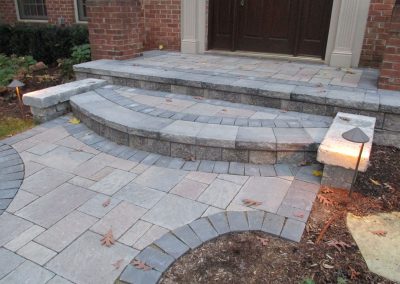
Find the location of `pillar`. pillar is located at coordinates (118, 40), (395, 71).